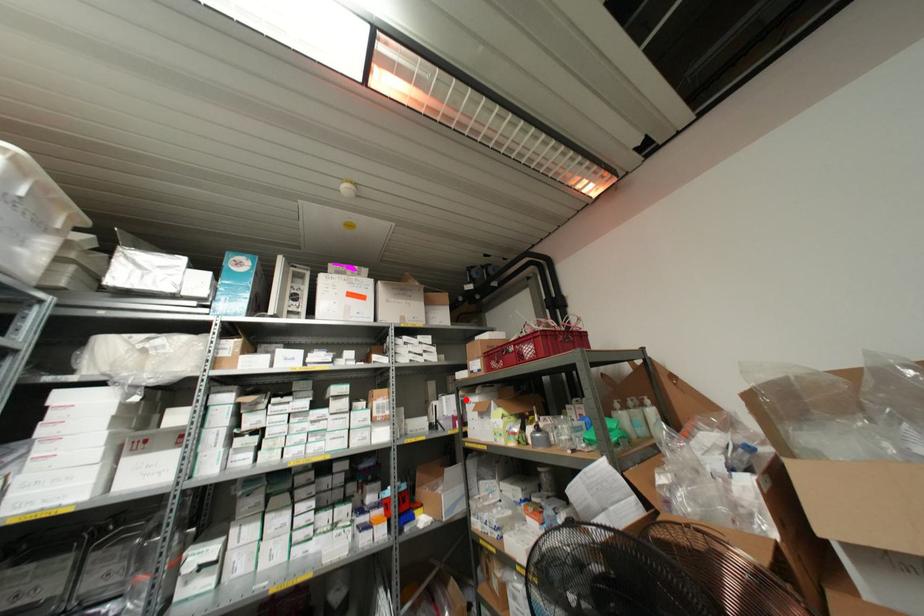
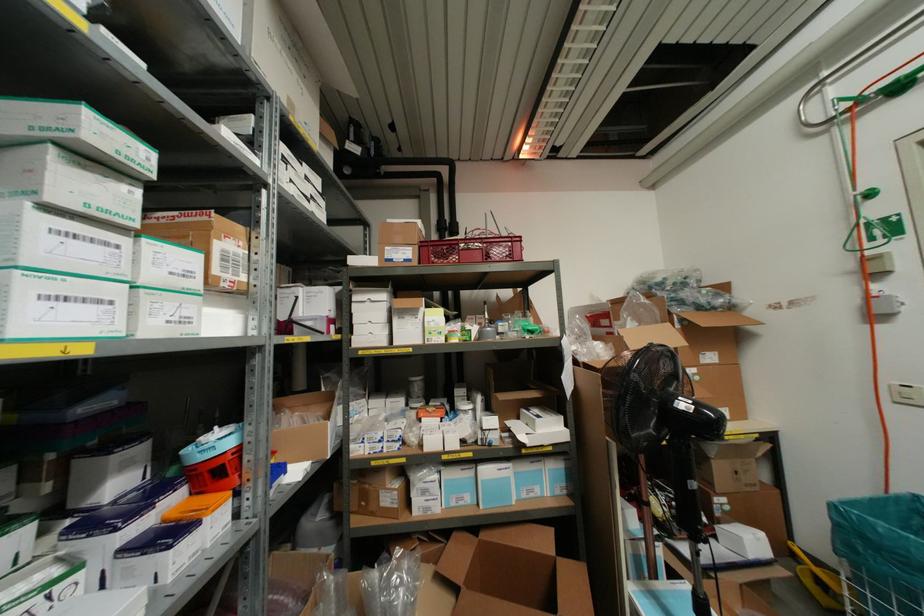
In the second image, find the point that corresponds to the highlighted location in the first image.

(354, 298)